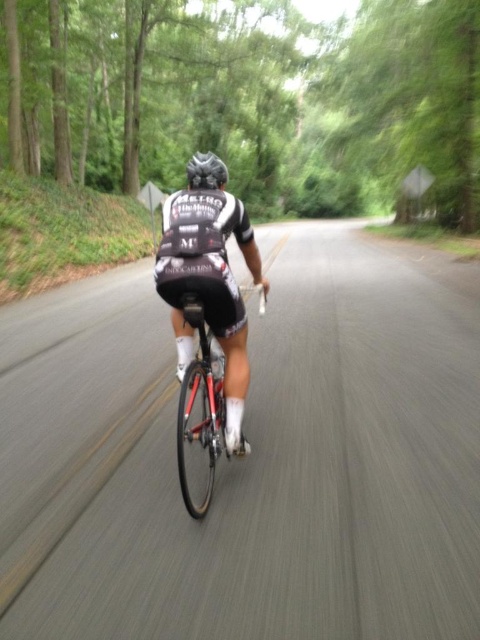
Question: Is shiny red bicycle at center closer to the viewer compared to black matte helmet at center?

Choices:
 (A) yes
 (B) no

Answer: (A)

Question: Which of these objects is positioned closest to the black matte cycling jersey at center?

Choices:
 (A) black matte helmet at center
 (B) shiny red bicycle at center

Answer: (B)

Question: Which point is closer to the camera?

Choices:
 (A) (211, 150)
 (B) (252, 241)
 (C) (193, 385)

Answer: (C)

Question: Is the position of shiny red bicycle at center more distant than that of black matte helmet at center?

Choices:
 (A) yes
 (B) no

Answer: (B)

Question: Which point is farther to the camera?

Choices:
 (A) black matte cycling jersey at center
 (B) shiny red bicycle at center

Answer: (A)

Question: Does black matte cycling jersey at center appear on the right side of black matte helmet at center?

Choices:
 (A) no
 (B) yes

Answer: (B)